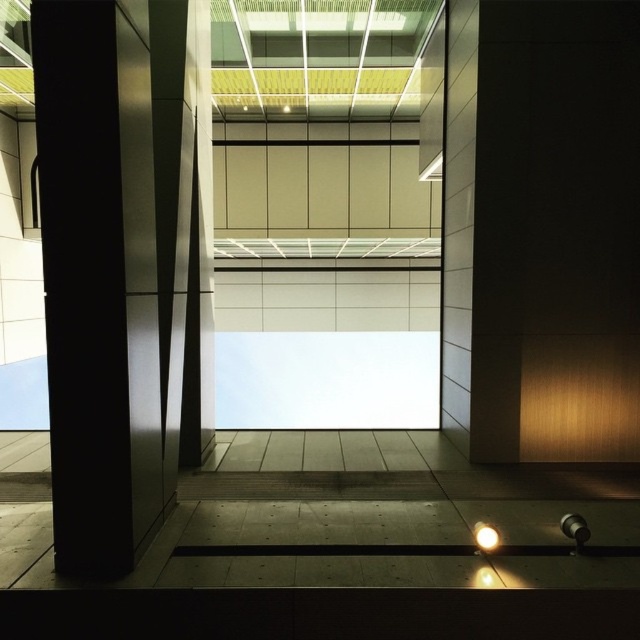
Question: Is metallic at left below white glossy light bulb at lower center?

Choices:
 (A) yes
 (B) no

Answer: (B)

Question: Which point is farther from the camera taking this photo?

Choices:
 (A) (150, 472)
 (B) (476, 541)

Answer: (A)

Question: Is metallic at left to the left of white glossy light bulb at lower center from the viewer's perspective?

Choices:
 (A) yes
 (B) no

Answer: (A)

Question: Among these objects, which one is farthest from the camera?

Choices:
 (A) metallic at left
 (B) white glossy light bulb at lower center

Answer: (B)

Question: Can you confirm if metallic at left is positioned below white glossy light bulb at lower center?

Choices:
 (A) yes
 (B) no

Answer: (B)